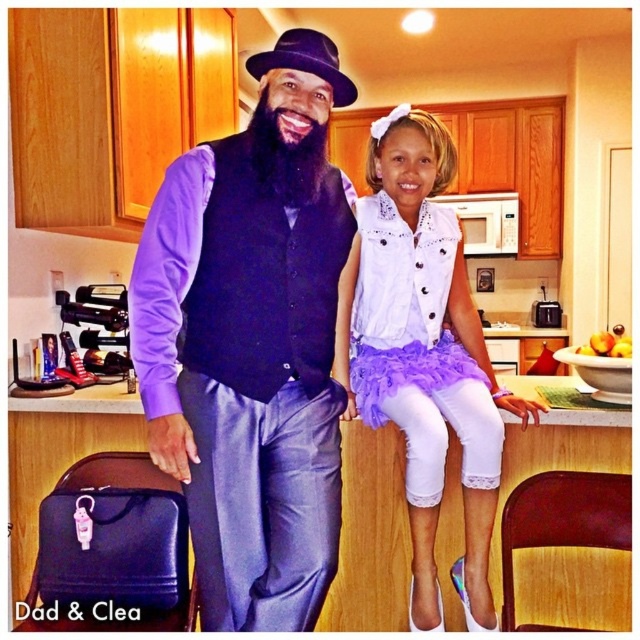
Is matte black vest at center to the left of white tulle skirt at center from the viewer's perspective?

Correct, you'll find matte black vest at center to the left of white tulle skirt at center.

Does matte black vest at center have a greater width compared to white tulle skirt at center?

No.

Locate an element on the screen. The height and width of the screenshot is (640, 640). matte black vest at center is located at coordinates (252, 342).

Who is more distant from viewer, (385, 417) or (384, 364)?

Point (384, 364)

Which is in front, point (346, 372) or point (378, 378)?

Point (378, 378) is more forward.

Between point (378, 193) and point (371, 296), which one is positioned behind?

The point (378, 193) is behind.

Locate an element on the screen. The image size is (640, 640). white tulle skirt at center is located at coordinates (422, 353).

Between matte black vest at center and white lace dress at upper right, which one appears on the right side from the viewer's perspective?

white lace dress at upper right is more to the right.

Is matte black vest at center to the left of white lace dress at upper right from the viewer's perspective?

Indeed, matte black vest at center is positioned on the left side of white lace dress at upper right.

Between point (196, 248) and point (376, 211), which one is positioned behind?

Positioned behind is point (376, 211).

In order to click on matte black vest at center in this screenshot , I will do `click(252, 342)`.